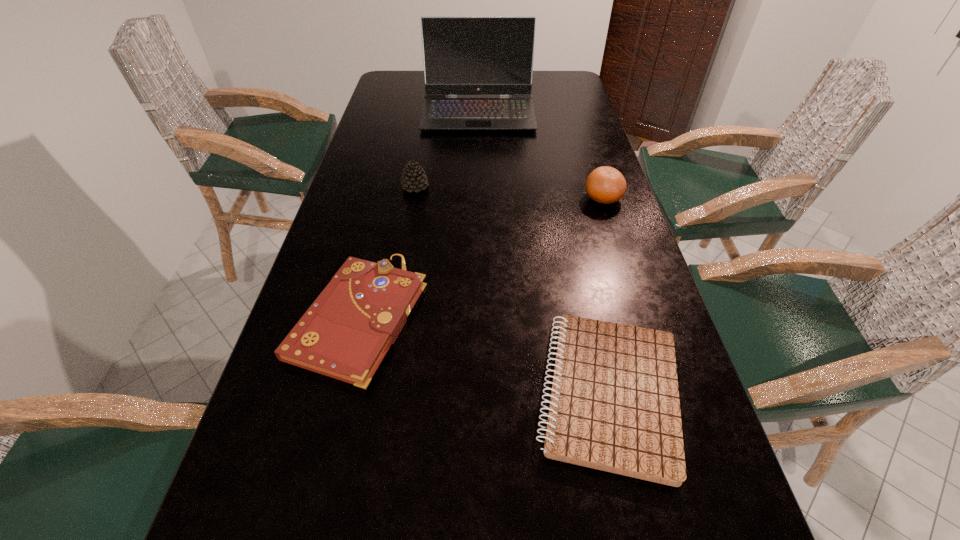
Where is `free area in between the laptop computer and the taller notebook`? Image resolution: width=960 pixels, height=540 pixels. free area in between the laptop computer and the taller notebook is located at coordinates (419, 215).

You are a GUI agent. You are given a task and a screenshot of the screen. Output one action in this format:
    pyautogui.click(x=<x>, y=<y>)
    Task: Click on the free spot between the right notebook and the pinecone
    This screenshot has height=540, width=960.
    Given the screenshot: What is the action you would take?
    pyautogui.click(x=512, y=291)

Identify the location of free spot between the pinecone and the shortest object. The height and width of the screenshot is (540, 960). (512, 291).

Point out which object is positioned as the fourth nearest to the tallest object. Please provide its 2D coordinates. Your answer should be formatted as a tuple, i.e. [(x, y)], where the tuple contains the x and y coordinates of a point satisfying the conditions above.

[(614, 406)]

Image resolution: width=960 pixels, height=540 pixels. I want to click on object that is the third nearest to the pinecone, so click(x=605, y=185).

Image resolution: width=960 pixels, height=540 pixels. Identify the location of vacant space that satisfies the following two spatial constraints: 1. at the narrow end of the pinecone; 2. on the back side of the shortest object. (379, 394).

Identify the location of free location that satisfies the following two spatial constraints: 1. on the back side of the second shortest object; 2. on the right side of the clementine. The width and height of the screenshot is (960, 540). (388, 198).

Where is `free space that satisfies the following two spatial constraints: 1. on the screen of the tallest object; 2. on the right side of the right notebook`? This screenshot has height=540, width=960. free space that satisfies the following two spatial constraints: 1. on the screen of the tallest object; 2. on the right side of the right notebook is located at coordinates (477, 394).

Image resolution: width=960 pixels, height=540 pixels. In order to click on vacant area in the image that satisfies the following two spatial constraints: 1. at the narrow end of the pinecone; 2. on the back side of the clementine in this screenshot , I will do `click(413, 198)`.

Locate an element on the screen. The image size is (960, 540). free spot that satisfies the following two spatial constraints: 1. on the screen of the tallest object; 2. at the narrow end of the pinecone is located at coordinates (478, 187).